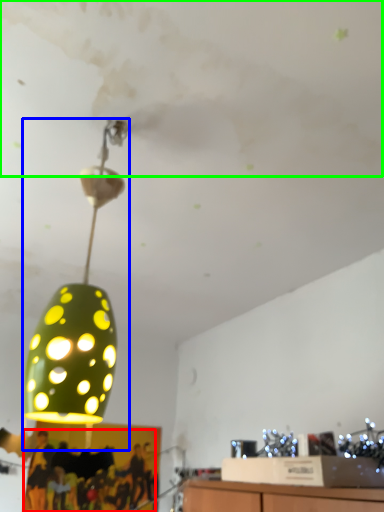
Question: Estimate the real-world distances between objects in this image. Which object is closer to person (highlighted by a red box), lamp (highlighted by a blue box) or cloud (highlighted by a green box)?

Choices:
 (A) lamp
 (B) cloud

Answer: (A)